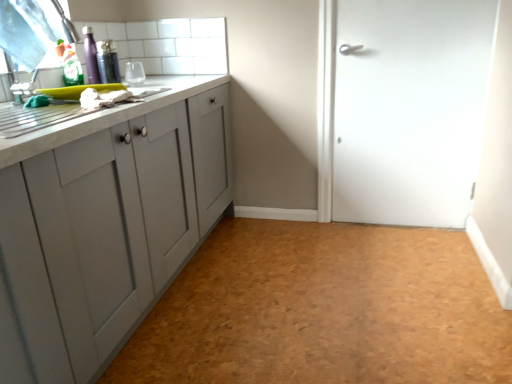
Question: Should I look upward or downward to see transparent plastic window screen at upper left?

Choices:
 (A) up
 (B) down

Answer: (A)

Question: Could white matte door at right be considered to be inside cork-textured floor at center?

Choices:
 (A) yes
 (B) no

Answer: (B)

Question: Is cork-textured floor at center positioned far away from white matte door at right?

Choices:
 (A) no
 (B) yes

Answer: (A)

Question: Does cork-textured floor at center have a lesser height compared to white matte door at right?

Choices:
 (A) no
 (B) yes

Answer: (B)

Question: Is cork-textured floor at center wider than white matte door at right?

Choices:
 (A) no
 (B) yes

Answer: (B)

Question: Is cork-textured floor at center bigger than white matte door at right?

Choices:
 (A) no
 (B) yes

Answer: (B)

Question: From the image's perspective, is cork-textured floor at center over white matte door at right?

Choices:
 (A) yes
 (B) no

Answer: (B)

Question: Is there a large distance between white tile at upper center and cork-textured floor at center?

Choices:
 (A) yes
 (B) no

Answer: (A)

Question: Can you confirm if white tile at upper center is positioned to the right of cork-textured floor at center?

Choices:
 (A) no
 (B) yes

Answer: (A)

Question: Considering the relative sizes of white tile at upper center and cork-textured floor at center in the image provided, is white tile at upper center taller than cork-textured floor at center?

Choices:
 (A) no
 (B) yes

Answer: (B)

Question: Does white tile at upper center contain cork-textured floor at center?

Choices:
 (A) yes
 (B) no

Answer: (B)

Question: Is cork-textured floor at center at the back of white tile at upper center?

Choices:
 (A) no
 (B) yes

Answer: (A)

Question: Is white tile at upper center outside of cork-textured floor at center?

Choices:
 (A) yes
 (B) no

Answer: (A)

Question: Is white matte door at right far from cork-textured floor at center?

Choices:
 (A) no
 (B) yes

Answer: (A)